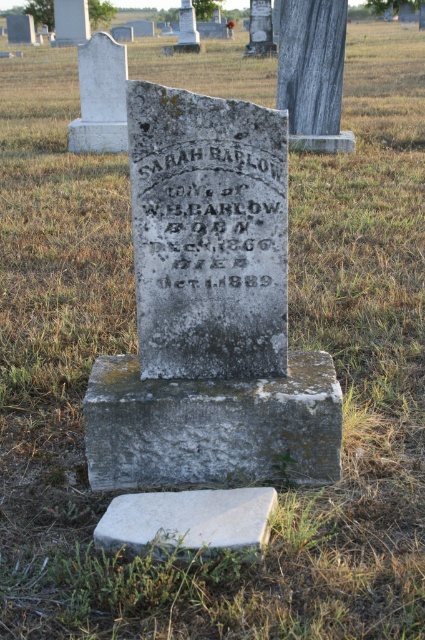
Question: Which point is closer to the camera?

Choices:
 (A) (173, 516)
 (B) (119, 416)
 (C) (153, 237)

Answer: (A)

Question: Can you confirm if dark gray stone inscription at center is positioned to the right of white stone slab at lower center?

Choices:
 (A) no
 (B) yes

Answer: (B)

Question: Can you confirm if gray stone base at center is thinner than dark gray stone inscription at center?

Choices:
 (A) yes
 (B) no

Answer: (B)

Question: Does dark gray stone inscription at center appear on the left side of white stone slab at lower center?

Choices:
 (A) yes
 (B) no

Answer: (B)

Question: Estimate the real-world distances between objects in this image. Which object is closer to the white stone slab at lower center?

Choices:
 (A) dark gray stone inscription at center
 (B) gray stone base at center

Answer: (B)

Question: Which point is farther to the camera?

Choices:
 (A) gray stone base at center
 (B) dark gray stone inscription at center

Answer: (A)